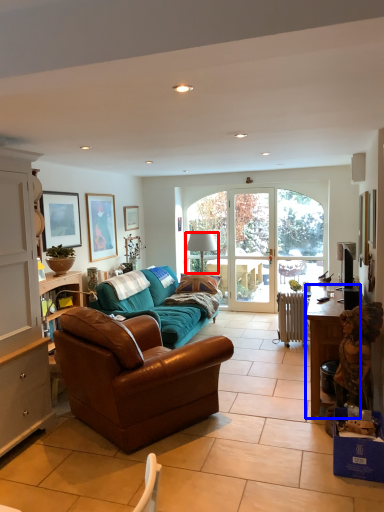
Question: Among these objects, which one is nearest to the camera, lamp (highlighted by a red box) or desk (highlighted by a blue box)?

Choices:
 (A) lamp
 (B) desk

Answer: (B)